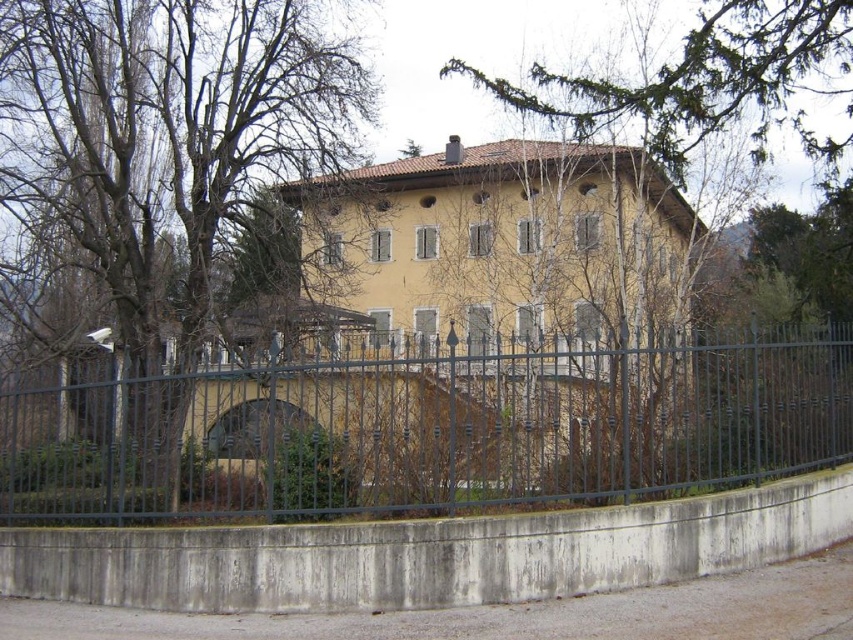
Question: Is the position of metallic dark green fence at center less distant than that of bare branches at left?

Choices:
 (A) yes
 (B) no

Answer: (A)

Question: Is bare branches at left smaller than green leafy tree at upper center?

Choices:
 (A) yes
 (B) no

Answer: (B)

Question: Which point appears closest to the camera in this image?

Choices:
 (A) (772, 93)
 (B) (207, 417)
 (C) (210, 314)

Answer: (A)

Question: Which point is closer to the camera?

Choices:
 (A) bare branches at left
 (B) green leafy tree at upper center
 (C) metallic dark green fence at center

Answer: (C)

Question: Which is nearer to the green leafy tree at upper center?

Choices:
 (A) bare branches at left
 (B) metallic dark green fence at center

Answer: (B)

Question: In this image, where is bare branches at left located relative to green leafy tree at upper center?

Choices:
 (A) below
 (B) above

Answer: (A)